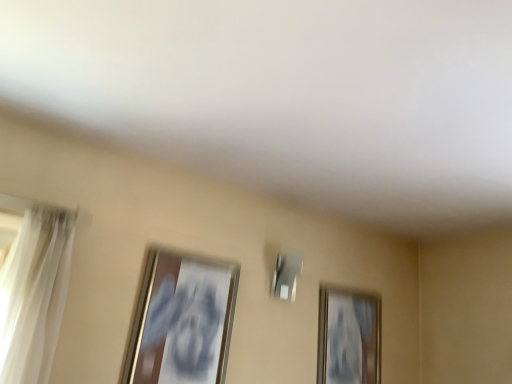
Question: From a real-world perspective, is metallic silver picture frame at left, arranged as the first picture frame when viewed from the front, physically located above or below white sheer curtain at left?

Choices:
 (A) below
 (B) above

Answer: (A)

Question: Does point (173, 302) appear closer or farther from the camera than point (18, 246)?

Choices:
 (A) closer
 (B) farther

Answer: (B)

Question: Which object is the closest to the metallic silver picture frame at left, the 2th picture frame from the right?

Choices:
 (A) gold metallic picture frame at upper right, the 2th picture frame viewed from the left
 (B) white sheer curtain at left

Answer: (B)

Question: Considering the real-world distances, which object is closest to the gold metallic picture frame at upper right, placed as the 1th picture frame when sorted from back to front?

Choices:
 (A) metallic silver picture frame at left, arranged as the first picture frame when viewed from the front
 (B) white sheer curtain at left

Answer: (A)